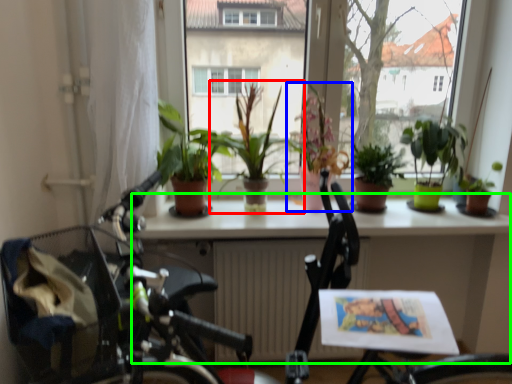
Question: Based on their relative distances, which object is nearer to houseplant (highlighted by a red box)? Choose from houseplant (highlighted by a blue box) and table (highlighted by a green box).

Choices:
 (A) houseplant
 (B) table

Answer: (A)